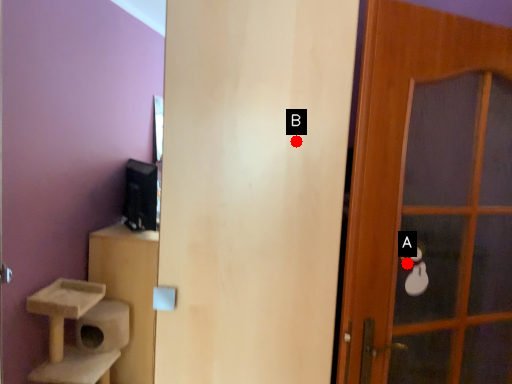
Question: Two points are circled on the image, labeled by A and B beside each circle. Among these points, which one is nearest to the camera?

Choices:
 (A) A is closer
 (B) B is closer

Answer: (B)